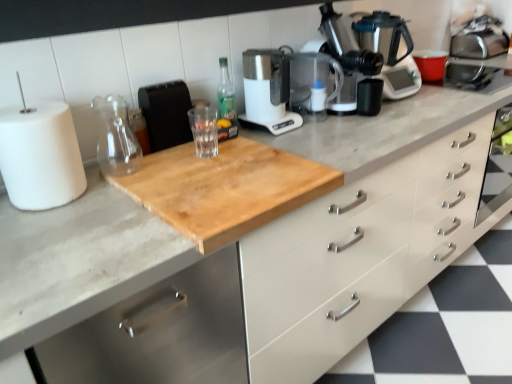
Question: Visually, is metallic silver coffee machine at upper right positioned to the left or to the right of satin silver coffee pot at upper right?

Choices:
 (A) left
 (B) right

Answer: (A)

Question: Is metallic silver coffee machine at upper right inside or outside of satin silver coffee pot at upper right?

Choices:
 (A) outside
 (B) inside

Answer: (A)

Question: Which object is positioned closest to the white matte paper towel at left?

Choices:
 (A) black matte cup at center, which is the first appliance in right-to-left order
 (B) black textured toaster at upper center, the first appliance in the left-to-right sequence
 (C) transparent glass at center, the first glass jar from the right
 (D) white plastic coffee maker at center
 (E) green glass bottle at center

Answer: (B)

Question: Which object is the closest to the natural wood cutting board at center?

Choices:
 (A) white plastic coffee maker at center
 (B) white matte paper towel at left
 (C) transparent glass at center, the first glass jar from the right
 (D) black matte cup at center, which is counted as the 3th appliance, starting from the left
 (E) black textured toaster at upper center, placed as the 3th appliance when sorted from right to left

Answer: (B)